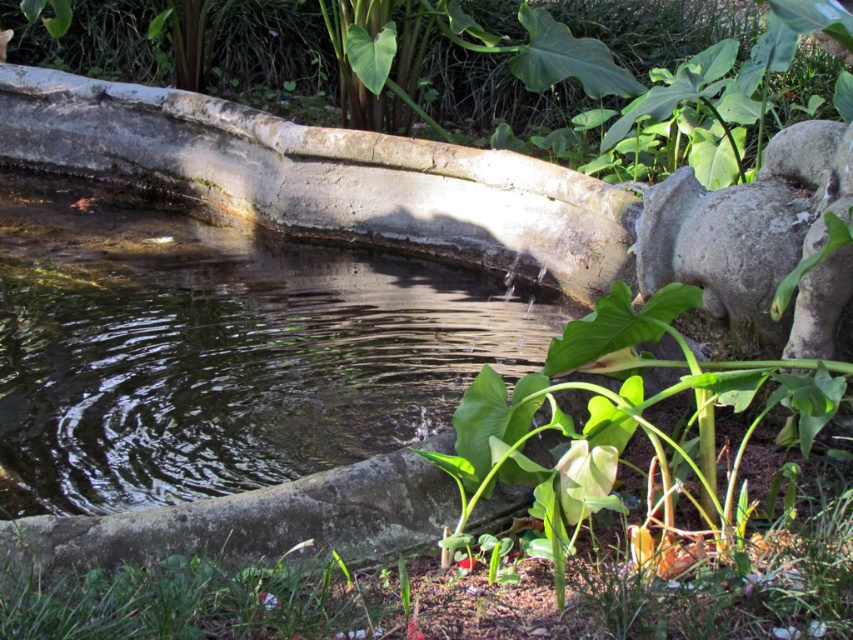
Question: Is green leafy plant at upper center thinner than gray stone pig at upper right?

Choices:
 (A) yes
 (B) no

Answer: (A)

Question: Which of the following is the farthest from the observer?

Choices:
 (A) (358, 33)
 (B) (677, 243)

Answer: (A)

Question: Is green leafy plant at upper center to the right of gray stone pig at upper right from the viewer's perspective?

Choices:
 (A) no
 (B) yes

Answer: (A)

Question: Can you confirm if green leafy plant at upper center is thinner than gray stone pig at upper right?

Choices:
 (A) yes
 (B) no

Answer: (A)

Question: Which point is closer to the camera taking this photo?

Choices:
 (A) (685, 236)
 (B) (254, 0)

Answer: (A)